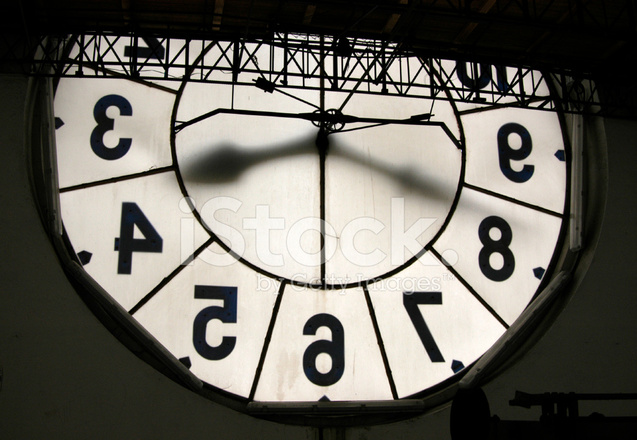
In order to click on ceiling in this screenshot , I will do `click(420, 24)`, `click(360, 18)`.